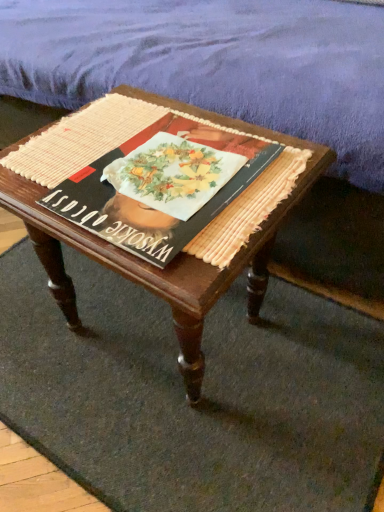
You are a GUI agent. You are given a task and a screenshot of the screen. Output one action in this format:
    pyautogui.click(x=<x>, y=<y>)
    Task: Click on the vacant position to the left of matte black book at center
    This screenshot has height=512, width=384.
    Given the screenshot: What is the action you would take?
    pyautogui.click(x=51, y=167)